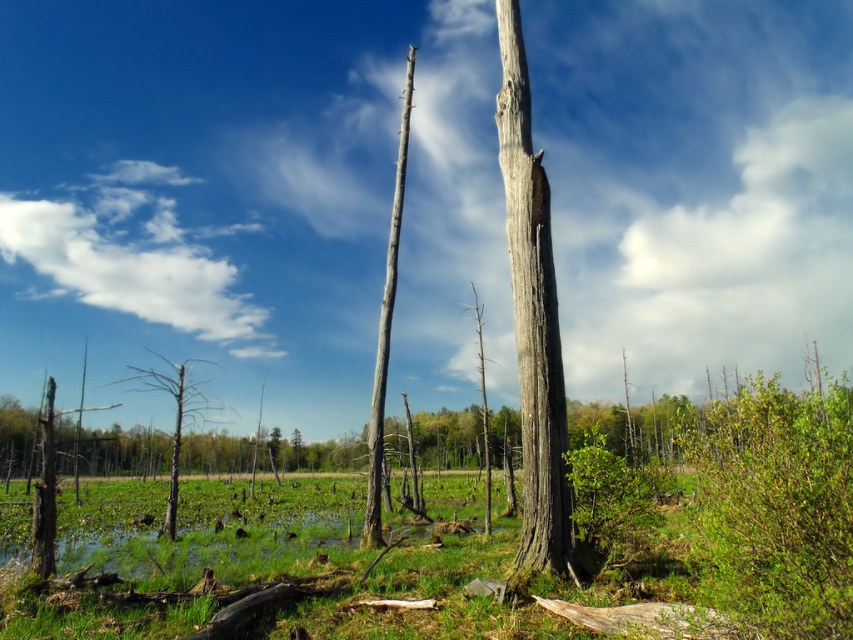
Does gray rough bark tree trunk at center appear under gray bark tree at center?

Actually, gray rough bark tree trunk at center is above gray bark tree at center.

Which is below, gray rough bark tree trunk at center or gray bark tree at center?

gray bark tree at center is below.

Who is more forward, (x=548, y=541) or (x=373, y=435)?

Point (x=548, y=541) is in front.

Find the location of a particular element. gray rough bark tree trunk at center is located at coordinates (x=532, y=320).

Is the position of gray bark tree at center less distant than that of brown textured tree at left?

That is True.

Can you confirm if gray bark tree at center is smaller than brown textured tree at left?

Indeed, gray bark tree at center has a smaller size compared to brown textured tree at left.

Who is more forward, [389,269] or [170,364]?

Point [389,269]

What are the coordinates of `gray bark tree at center` in the screenshot? It's located at (386, 330).

Does gray rough bark tree trunk at center have a lesser width compared to brown textured tree at left?

Indeed, gray rough bark tree trunk at center has a lesser width compared to brown textured tree at left.

Who is positioned more to the left, gray rough bark tree trunk at center or brown textured tree at left?

brown textured tree at left is more to the left.

Between point (535, 426) and point (207, 406), which one is positioned behind?

Positioned behind is point (207, 406).

At what (x,y) coordinates should I click in order to perform the action: click on gray rough bark tree trunk at center. Please return your answer as a coordinate pair (x, y). Looking at the image, I should click on (532, 320).